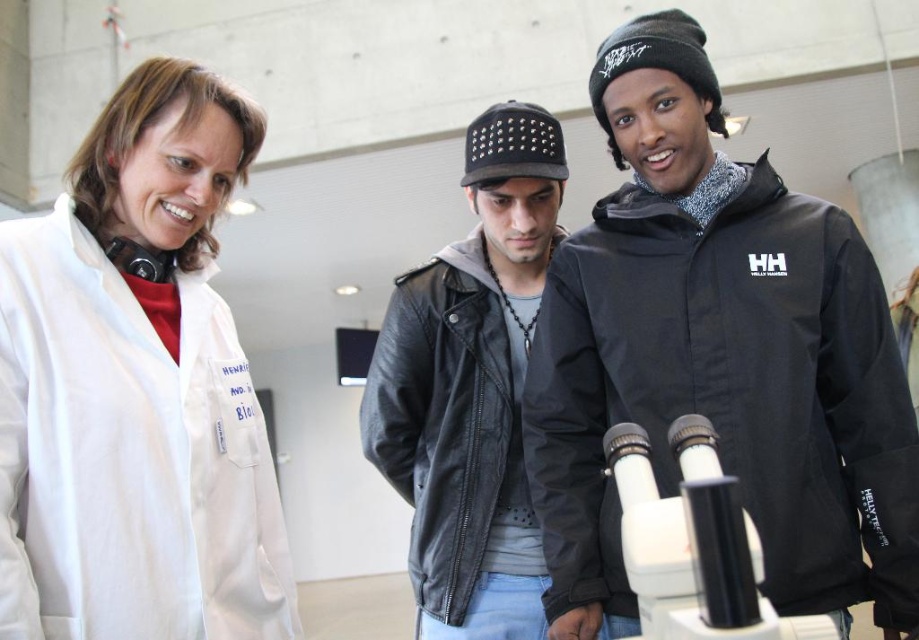
Question: Which point is farther to the camera?

Choices:
 (A) white plastic microscope at center
 (B) black leather jacket at center
 (C) white lab coat at upper left

Answer: (B)

Question: Among these objects, which one is nearest to the camera?

Choices:
 (A) white lab coat at upper left
 (B) white plastic microscope at center
 (C) black leather jacket at center

Answer: (B)

Question: Can you confirm if black leather jacket at center is positioned to the left of white plastic microscope at center?

Choices:
 (A) yes
 (B) no

Answer: (A)

Question: Which object is closer to the camera taking this photo?

Choices:
 (A) white lab coat at upper left
 (B) white plastic microscope at center
 (C) black leather jacket at center
 (D) black waterproof jacket at center

Answer: (B)

Question: Observing the image, what is the correct spatial positioning of white lab coat at upper left in reference to black leather jacket at center?

Choices:
 (A) above
 (B) below

Answer: (A)

Question: Is black waterproof jacket at center positioned at the back of white plastic microscope at center?

Choices:
 (A) yes
 (B) no

Answer: (A)